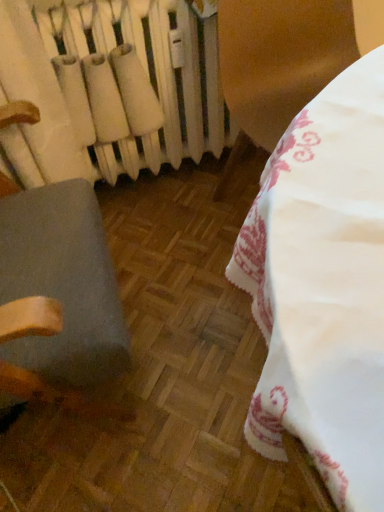
Where is `white matte radiator at upper left`? white matte radiator at upper left is located at coordinates (139, 71).

What do you see at coordinates (139, 71) in the screenshot? I see `white matte radiator at upper left` at bounding box center [139, 71].

Locate an element on the screen. gray fabric chair at left is located at coordinates (54, 245).

In order to face gray fabric chair at left, should I rotate leftwards or rightwards?

Rotate your view left by about 23.015°.

Describe the element at coordinates (54, 245) in the screenshot. I see `gray fabric chair at left` at that location.

What are the coordinates of `white matte radiator at upper left` in the screenshot? It's located at (139, 71).

Considering the relative positions of white matte radiator at upper left and gray fabric chair at left in the image provided, is white matte radiator at upper left to the left or to the right of gray fabric chair at left?

From the image, it's evident that white matte radiator at upper left is to the right of gray fabric chair at left.

In the image, is white matte radiator at upper left positioned in front of or behind gray fabric chair at left?

In the image, white matte radiator at upper left appears behind gray fabric chair at left.

Does point (110, 22) appear closer or farther from the camera than point (18, 366)?

Point (110, 22).

From the image's perspective, which one is positioned lower, white matte radiator at upper left or gray fabric chair at left?

gray fabric chair at left is shown below in the image.

From a real-world perspective, does white matte radiator at upper left sit lower than gray fabric chair at left?

Indeed, from a real-world perspective, white matte radiator at upper left is positioned beneath gray fabric chair at left.

Can you confirm if white matte radiator at upper left is wider than gray fabric chair at left?

In fact, white matte radiator at upper left might be narrower than gray fabric chair at left.

Considering the relative sizes of white matte radiator at upper left and gray fabric chair at left in the image provided, is white matte radiator at upper left shorter than gray fabric chair at left?

Yes, white matte radiator at upper left is shorter than gray fabric chair at left.

Can you confirm if white matte radiator at upper left is smaller than gray fabric chair at left?

Indeed, white matte radiator at upper left has a smaller size compared to gray fabric chair at left.

Is gray fabric chair at left completely or partially inside white matte radiator at upper left?

No, gray fabric chair at left is not inside white matte radiator at upper left.

Are white matte radiator at upper left and gray fabric chair at left located far from each other?

Actually, white matte radiator at upper left and gray fabric chair at left are a little close together.

Is white matte radiator at upper left turned away from gray fabric chair at left?

No, white matte radiator at upper left is not facing away from gray fabric chair at left.

How different are the orientations of white matte radiator at upper left and gray fabric chair at left in degrees?

The angular difference between white matte radiator at upper left and gray fabric chair at left is 90.9 degrees.

This screenshot has width=384, height=512. Identify the location of radiator located on the right of gray fabric chair at left. pyautogui.click(x=139, y=71).

Does gray fabric chair at left appear on the left side of white matte radiator at upper left?

Indeed, gray fabric chair at left is positioned on the left side of white matte radiator at upper left.

Considering the positions of objects gray fabric chair at left and white matte radiator at upper left in the image provided, who is in front, gray fabric chair at left or white matte radiator at upper left?

Positioned in front is gray fabric chair at left.

Considering the points (0, 385) and (172, 154), which point is behind, point (0, 385) or point (172, 154)?

The point (172, 154) is more distant.

From the image's perspective, is gray fabric chair at left above or below white matte radiator at upper left?

Clearly, from the image's perspective, gray fabric chair at left is below white matte radiator at upper left.

From a real-world perspective, is gray fabric chair at left under white matte radiator at upper left?

No, from a real-world perspective, gray fabric chair at left is not beneath white matte radiator at upper left.

Is gray fabric chair at left thinner than white matte radiator at upper left?

In fact, gray fabric chair at left might be wider than white matte radiator at upper left.

Considering the sizes of objects gray fabric chair at left and white matte radiator at upper left in the image provided, who is taller, gray fabric chair at left or white matte radiator at upper left?

With more height is gray fabric chair at left.

Based on their sizes in the image, would you say gray fabric chair at left is bigger or smaller than white matte radiator at upper left?

gray fabric chair at left is bigger than white matte radiator at upper left.

Which is correct: gray fabric chair at left is inside white matte radiator at upper left, or outside of it?

gray fabric chair at left exists outside the volume of white matte radiator at upper left.

Is gray fabric chair at left with white matte radiator at upper left?

They are not placed beside each other.

Is gray fabric chair at left positioned with its back to white matte radiator at upper left?

That's not correct — gray fabric chair at left is not looking away from white matte radiator at upper left.

This screenshot has width=384, height=512. Find the location of `furniture below the white matte radiator at upper left (from the image's perspective)`. furniture below the white matte radiator at upper left (from the image's perspective) is located at coordinates (54, 245).

This screenshot has width=384, height=512. In order to click on furniture above the white matte radiator at upper left (from a real-world perspective) in this screenshot , I will do `click(54, 245)`.

The image size is (384, 512). Find the location of `radiator below the gray fabric chair at left (from a real-world perspective)`. radiator below the gray fabric chair at left (from a real-world perspective) is located at coordinates (139, 71).